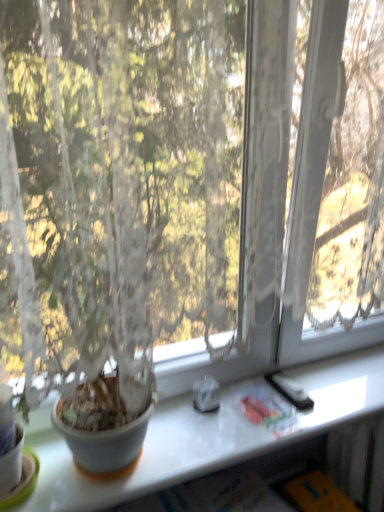
Based on the photo, measure the distance between point (109,501) and camera.

Point (109,501) and camera are 31.77 inches apart.

Describe the element at coordinates (205, 436) in the screenshot. I see `white glossy table at lower center` at that location.

Identify the location of white glossy table at lower center. (205, 436).

What is the approximate height of white glossy table at lower center?

1.95 inches.

I want to click on white glossy table at lower center, so click(205, 436).